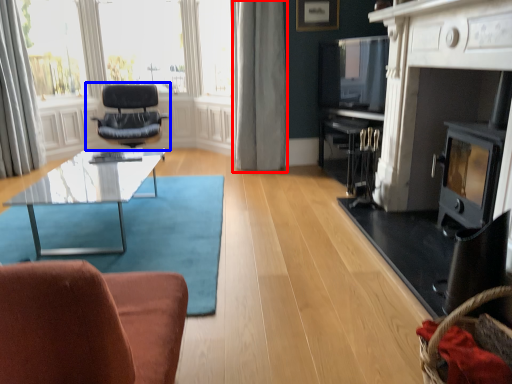
Question: Which object is further to the camera taking this photo, curtain (highlighted by a red box) or chair (highlighted by a blue box)?

Choices:
 (A) curtain
 (B) chair

Answer: (B)